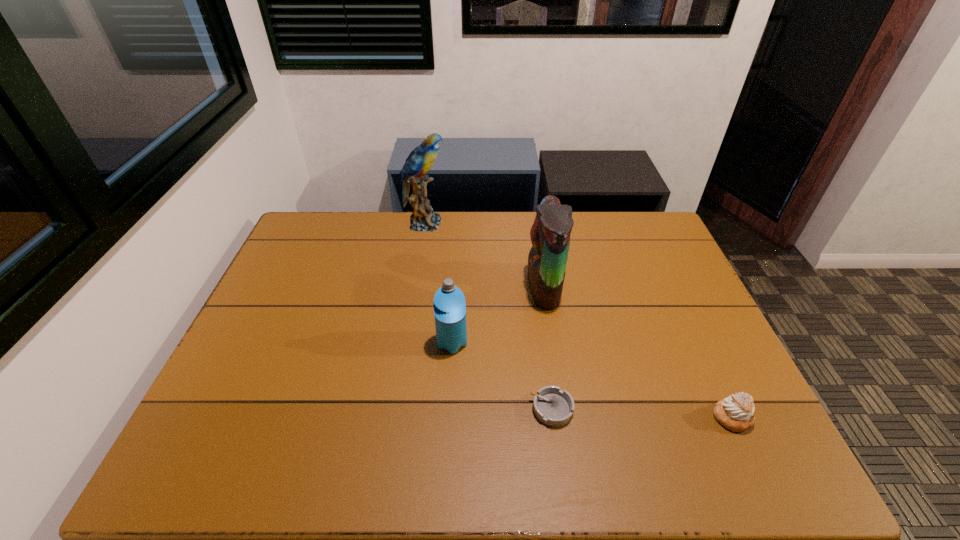
The image size is (960, 540). In the image, there is a desktop. What are the coordinates of `free region at the left edge` in the screenshot? It's located at (222, 375).

In the image, there is a desktop. Where is `vacant space at the right edge`? vacant space at the right edge is located at coordinates pyautogui.click(x=664, y=253).

Where is `free space at the far right corner`? The width and height of the screenshot is (960, 540). free space at the far right corner is located at coordinates (649, 220).

Image resolution: width=960 pixels, height=540 pixels. In order to click on vacant space in between the farthest object and the third tallest object in this screenshot , I will do `click(439, 283)`.

The height and width of the screenshot is (540, 960). What are the coordinates of `empty location between the pastry and the second object from left to right` in the screenshot? It's located at (592, 380).

Where is `vacant space that's between the fourth object from right to left and the pastry`? vacant space that's between the fourth object from right to left and the pastry is located at coordinates (592, 380).

In order to click on free space between the second shortest object and the left parrot in this screenshot , I will do 578,320.

I want to click on vacant space in between the rightmost object and the right parrot, so click(x=637, y=352).

Locate an element on the screen. The height and width of the screenshot is (540, 960). free space between the second object from left to right and the right parrot is located at coordinates (498, 315).

I want to click on free space between the taller parrot and the fourth object from right to left, so click(x=439, y=283).